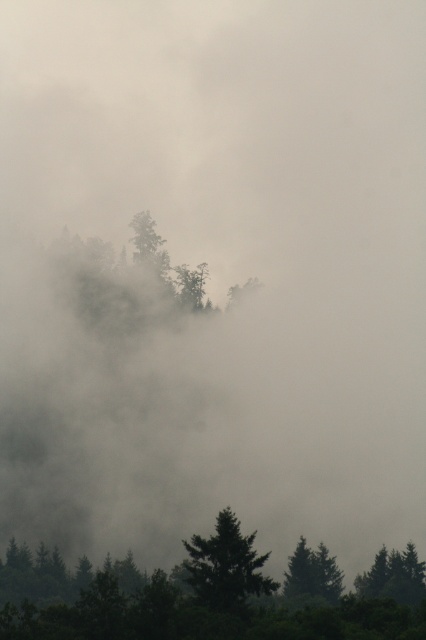
Can you confirm if green matte trees at lower center is wider than green matte tree at lower center?

Correct, the width of green matte trees at lower center exceeds that of green matte tree at lower center.

Is green matte trees at lower center behind green matte tree at lower center?

No, green matte trees at lower center is in front of green matte tree at lower center.

Where is `green matte trees at lower center`? The width and height of the screenshot is (426, 640). green matte trees at lower center is located at coordinates pos(213,596).